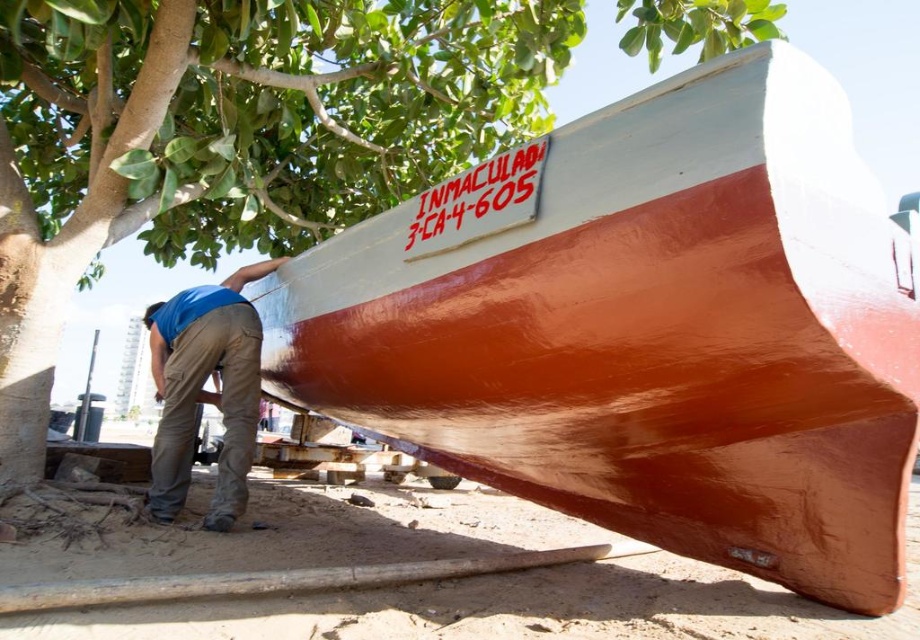
Question: Among these points, which one is farthest from the camera?

Choices:
 (A) [857, 506]
 (B) [530, 616]

Answer: (B)

Question: Is smooth brown sand at lower center below blue cotton shirt at lower left?

Choices:
 (A) yes
 (B) no

Answer: (A)

Question: Among these objects, which one is nearest to the camera?

Choices:
 (A) green leafy tree at upper left
 (B) shiny orange hull at center

Answer: (B)

Question: Does shiny orange hull at center have a larger size compared to smooth brown sand at lower center?

Choices:
 (A) yes
 (B) no

Answer: (A)

Question: Can you confirm if green leafy tree at upper left is positioned above smooth brown sand at lower center?

Choices:
 (A) yes
 (B) no

Answer: (A)

Question: Which is nearer to the shiny orange hull at center?

Choices:
 (A) smooth brown sand at lower center
 (B) blue cotton shirt at lower left

Answer: (B)